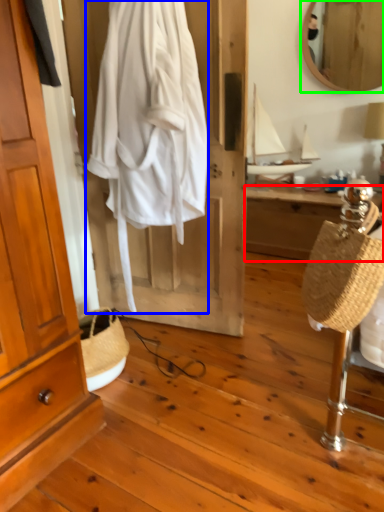
Question: Which object is positioned closest to desk (highlighted by a red box)? Select from clothing (highlighted by a blue box) and mirror (highlighted by a green box).

Choices:
 (A) clothing
 (B) mirror

Answer: (B)